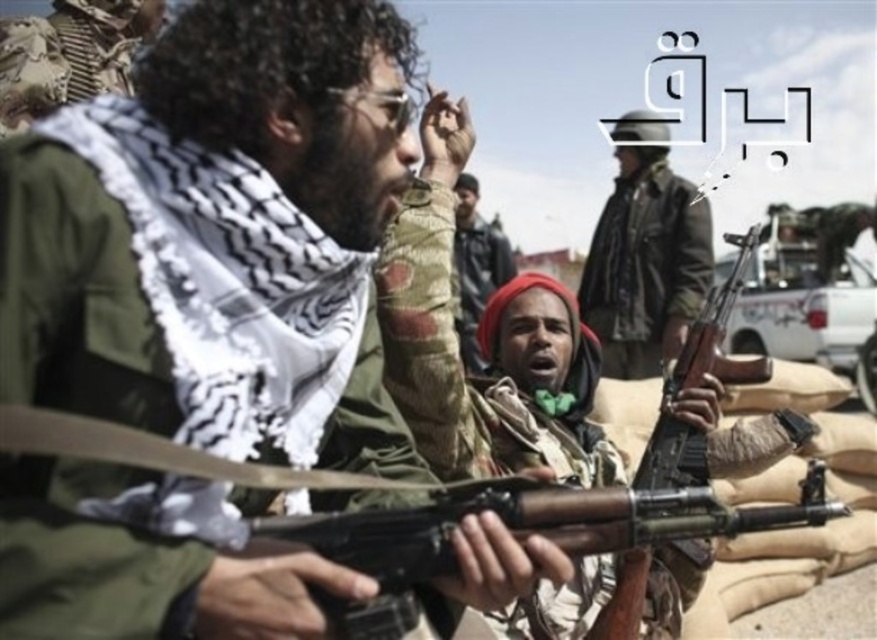
You are a drone operator trying to drop a package between the two men holding AK47 rifles in the scene. The coordinates of the point between them are point (687, 316). Given that the distance between them is 89.66 meters, can you confirm if the package will land safely between them without hitting either?

The two men are 89.66 meters apart, so the package will land safely between them at point (687, 316) as it is midway and the distance is sufficient to avoid both.

You are a drone operator trying to locate a specific object in the image. The coordinates of the matte black helmet at upper center are given as point A. If you need to aim a laser pointer at this point from your current position, which object in the scene would the laser hit first?

The laser would hit the matte black helmet at upper center first because it is the closest object to the drone operator at point A.